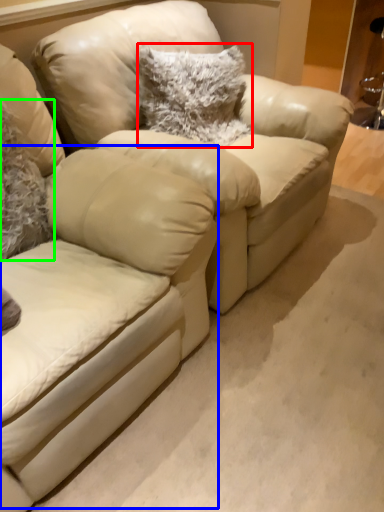
Question: Which is nearer to the pillow (highlighted by a red box)? swivel chair (highlighted by a blue box) or pillow (highlighted by a green box).

Choices:
 (A) swivel chair
 (B) pillow

Answer: (B)